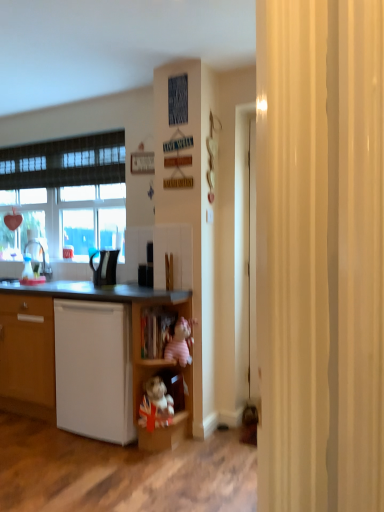
Question: Considering the positions of point (139, 270) and point (137, 309), is point (139, 270) closer or farther from the camera than point (137, 309)?

Choices:
 (A) farther
 (B) closer

Answer: (A)

Question: From a real-world perspective, is black plastic kettle at center, the first appliance from the right, above or below wooden shelf at center?

Choices:
 (A) below
 (B) above

Answer: (B)

Question: Which of these objects is positioned farthest from the white matte cupboard at lower left?

Choices:
 (A) wooden cabinet at lower center, which is the first cabinet in top-to-bottom order
 (B) wooden shelf at center
 (C) white matte dishwasher at lower left
 (D) wooden plush toy at lower center, which ranks as the 1th cabinet in bottom-to-top order
 (E) black glossy kettle at center, which appears as the second appliance when viewed from the right

Answer: (E)

Question: Which is farther from the wooden plush toy at lower center, the 2th cabinet positioned from the top?

Choices:
 (A) wooden cabinet at lower center, which is the first cabinet in top-to-bottom order
 (B) black glossy kettle at center, which appears as the second appliance when viewed from the right
 (C) white matte cupboard at lower left
 (D) pink plush toy at center
 (E) black plastic kettle at center, the first appliance from the right

Answer: (B)